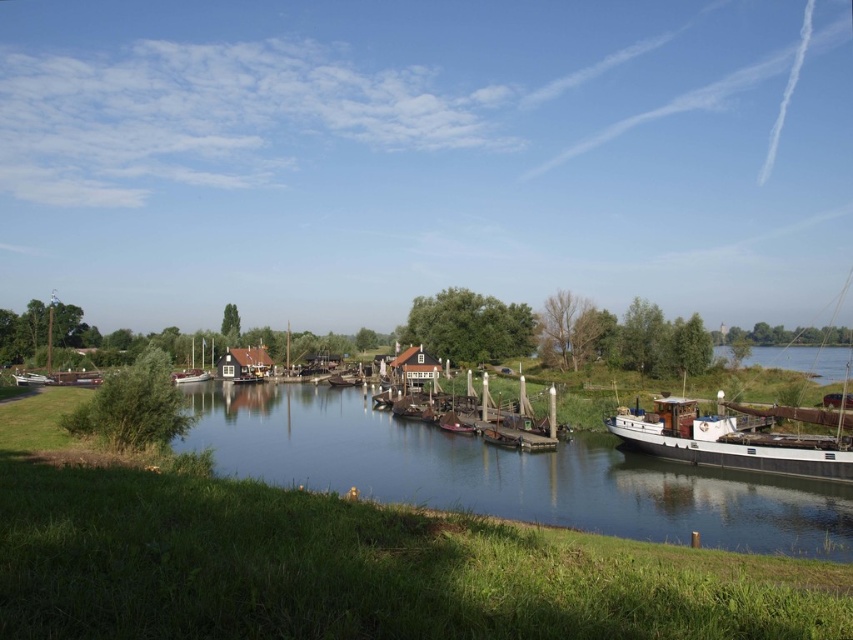
Question: Which object appears farthest from the camera in this image?

Choices:
 (A) smooth brown water at center
 (B) white matte barge at right

Answer: (B)

Question: Which point is farther to the camera?

Choices:
 (A) (708, 490)
 (B) (196, 378)
 (C) (791, 433)
 (D) (180, 374)

Answer: (B)

Question: Does wooden boat at center appear over white wooden boat at center-left?

Choices:
 (A) yes
 (B) no

Answer: (B)

Question: Does smooth brown water at center have a lesser width compared to white matte barge at right?

Choices:
 (A) yes
 (B) no

Answer: (B)

Question: Is smooth brown water at center closer to camera compared to white matte barge at right?

Choices:
 (A) yes
 (B) no

Answer: (A)

Question: Estimate the real-world distances between objects in this image. Which object is farther from the smooth brown water at center?

Choices:
 (A) white matte barge at right
 (B) white wooden boat at center-left
 (C) wooden sailboat at center

Answer: (C)